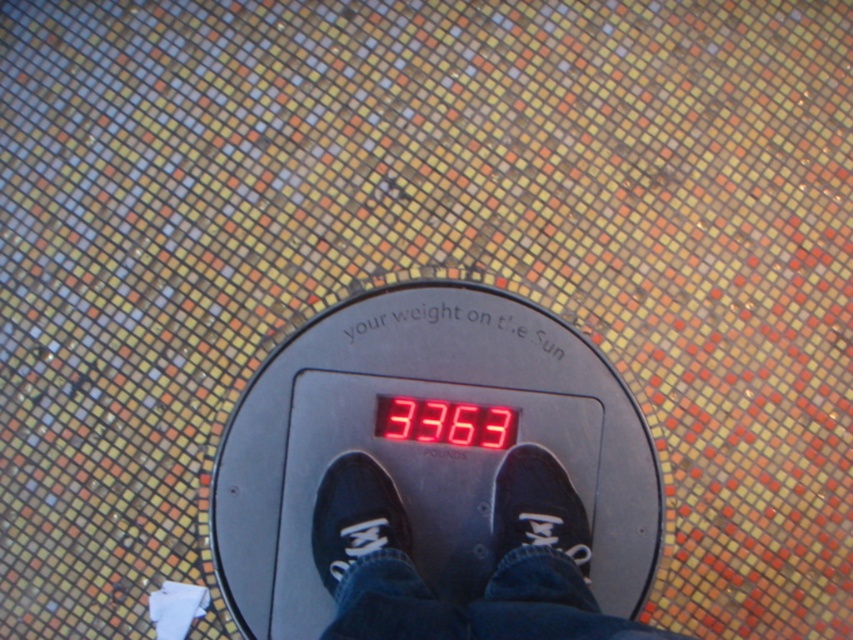
You are a delivery robot with a height of 1.5 meters. You need to deliver a package to the black plastic scale at center. Can you see the top of the scale from your current position?

The distance between the black plastic scale at center and the camera is 1.39 meters. Since the robot is 1.5 meters tall, it can see the top of the black plastic scale at center.

You are trying to determine if the black plastic scale at center can fit entirely within the space occupied by the black canvas shoes at center. Based on the scene description, can the scale fit within the shoes?

The black plastic scale at center might be wider than black canvas shoes at center, so it is uncertain if the scale can fit within the shoes. Further measurement is needed to confirm.